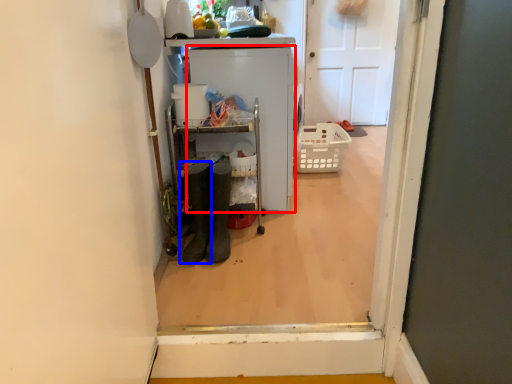
Question: Which object appears farthest to the camera in this image, appliance (highlighted by a red box) or footwear (highlighted by a blue box)?

Choices:
 (A) appliance
 (B) footwear

Answer: (A)